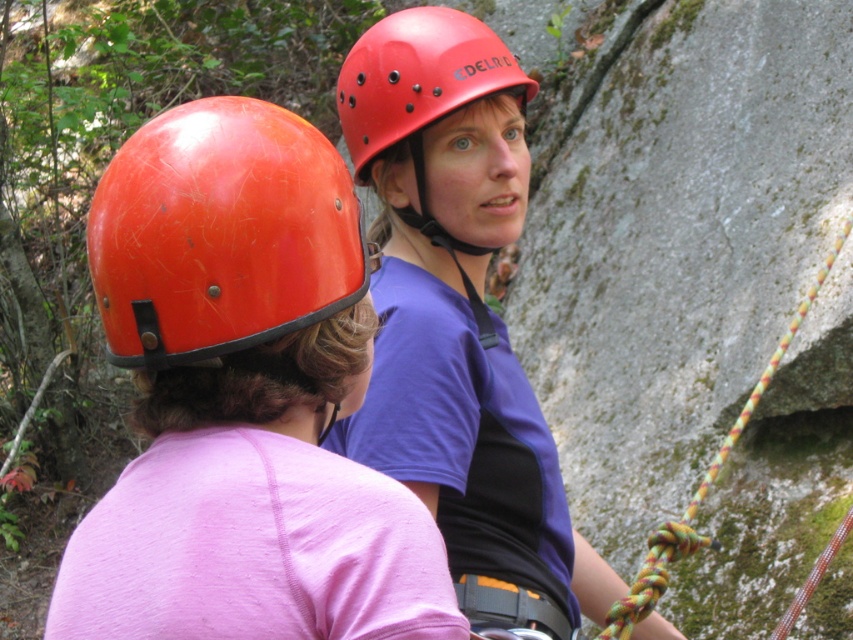
Can you confirm if orange matte helmet at left is thinner than red matte helmet at center?

Yes.

Which is behind, point (196, 212) or point (376, 237)?

Point (376, 237)

At what (x,y) coordinates should I click in order to perform the action: click on orange matte helmet at left. Please return your answer as a coordinate pair (x, y). This screenshot has width=853, height=640. Looking at the image, I should click on (x=221, y=234).

Is point (161, 177) positioned behind point (727, 449)?

No, (161, 177) is in front of (727, 449).

Does point (267, 264) come closer to viewer compared to point (619, 624)?

Yes, it is.

Who is more forward, (x=387, y=499) or (x=618, y=600)?

Point (x=387, y=499)

Locate an element on the screen. matte orange helmet at upper center is located at coordinates click(x=242, y=400).

Can you confirm if matte orange helmet at upper center is bigger than red matte helmet at center?

Correct, matte orange helmet at upper center is larger in size than red matte helmet at center.

Which is above, matte orange helmet at upper center or red matte helmet at center?

red matte helmet at center

I want to click on matte orange helmet at upper center, so click(242, 400).

Identify the location of matte orange helmet at upper center. This screenshot has height=640, width=853. pos(242,400).